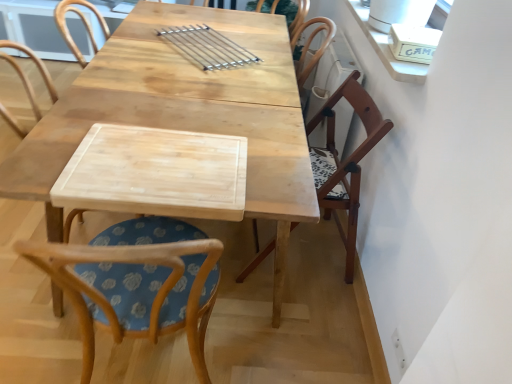
Where is `vacant space situated above natural wood cutting board at center (from a real-world perspective)`? Image resolution: width=512 pixels, height=384 pixels. vacant space situated above natural wood cutting board at center (from a real-world perspective) is located at coordinates (165, 162).